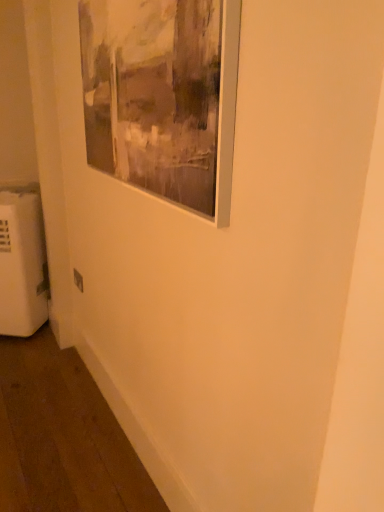
What do you see at coordinates (163, 96) in the screenshot? I see `matte silver picture frame at upper left` at bounding box center [163, 96].

The height and width of the screenshot is (512, 384). What do you see at coordinates (22, 262) in the screenshot?
I see `white plastic radiator at lower left` at bounding box center [22, 262].

The image size is (384, 512). What are the coordinates of `white plastic electric outlet at lower left` in the screenshot? It's located at (78, 280).

Between matte silver picture frame at upper left and white plastic radiator at lower left, which one has smaller size?

matte silver picture frame at upper left is smaller.

From a real-world perspective, which object rests below the other?

white plastic radiator at lower left is physically lower.

Is matte silver picture frame at upper left shorter than white plastic radiator at lower left?

Indeed, matte silver picture frame at upper left has a lesser height compared to white plastic radiator at lower left.

Is matte silver picture frame at upper left looking in the opposite direction of white plastic radiator at lower left?

No, white plastic radiator at lower left is not at the back of matte silver picture frame at upper left.

In the scene shown: Is white plastic radiator at lower left inside or outside of matte silver picture frame at upper left?

white plastic radiator at lower left is not enclosed by matte silver picture frame at upper left.

Relative to matte silver picture frame at upper left, is white plastic radiator at lower left in front or behind?

In the image, white plastic radiator at lower left appears behind matte silver picture frame at upper left.

From a real-world perspective, does white plastic radiator at lower left stand above matte silver picture frame at upper left?

Actually, white plastic radiator at lower left is physically below matte silver picture frame at upper left in the real world.

Considering the sizes of objects white plastic radiator at lower left and matte silver picture frame at upper left in the image provided, who is taller, white plastic radiator at lower left or matte silver picture frame at upper left?

white plastic radiator at lower left.

From a real-world perspective, is white plastic radiator at lower left beneath white plastic electric outlet at lower left?

Correct, in the physical world, white plastic radiator at lower left is lower than white plastic electric outlet at lower left.

Consider the image. Considering the relative sizes of white plastic radiator at lower left and white plastic electric outlet at lower left in the image provided, is white plastic radiator at lower left thinner than white plastic electric outlet at lower left?

Incorrect, the width of white plastic radiator at lower left is not less than that of white plastic electric outlet at lower left.

Is white plastic radiator at lower left beside white plastic electric outlet at lower left?

white plastic radiator at lower left is not next to white plastic electric outlet at lower left, and they're not touching.

Can you tell me how much white plastic radiator at lower left and white plastic electric outlet at lower left differ in facing direction?

They differ by 1.26 degrees in their facing directions.

Looking at this image, which is correct: matte silver picture frame at upper left is inside white plastic electric outlet at lower left, or outside of it?

matte silver picture frame at upper left cannot be found inside white plastic electric outlet at lower left.

Is matte silver picture frame at upper left facing towards white plastic electric outlet at lower left?

No, matte silver picture frame at upper left does not turn towards white plastic electric outlet at lower left.

Considering the relative sizes of matte silver picture frame at upper left and white plastic electric outlet at lower left in the image provided, is matte silver picture frame at upper left wider than white plastic electric outlet at lower left?

Indeed, matte silver picture frame at upper left has a greater width compared to white plastic electric outlet at lower left.

How different are the orientations of matte silver picture frame at upper left and white plastic electric outlet at lower left in degrees?

matte silver picture frame at upper left and white plastic electric outlet at lower left are facing 0.0845 degrees away from each other.

Is white plastic electric outlet at lower left looking in the opposite direction of matte silver picture frame at upper left?

white plastic electric outlet at lower left does not have its back to matte silver picture frame at upper left.

Considering the sizes of white plastic electric outlet at lower left and matte silver picture frame at upper left in the image, is white plastic electric outlet at lower left taller or shorter than matte silver picture frame at upper left?

white plastic electric outlet at lower left is shorter than matte silver picture frame at upper left.

Is white plastic electric outlet at lower left positioned in front of matte silver picture frame at upper left?

No.

Is white plastic electric outlet at lower left bigger than matte silver picture frame at upper left?

No.

Which is behind, white plastic electric outlet at lower left or white plastic radiator at lower left?

white plastic electric outlet at lower left.

Considering the relative positions of white plastic electric outlet at lower left and white plastic radiator at lower left in the image provided, is white plastic electric outlet at lower left to the right of white plastic radiator at lower left from the viewer's perspective?

Indeed, white plastic electric outlet at lower left is positioned on the right side of white plastic radiator at lower left.

Considering the positions of point (82, 283) and point (7, 330), is point (82, 283) closer or farther from the camera than point (7, 330)?

Clearly, point (82, 283) is closer to the camera than point (7, 330).

From the image's perspective, between white plastic electric outlet at lower left and white plastic radiator at lower left, who is located below?

white plastic electric outlet at lower left appears lower in the image.

Find the location of a particular element. The width and height of the screenshot is (384, 512). picture frame on the right of white plastic radiator at lower left is located at coordinates (163, 96).

Find the location of a particular element. This screenshot has height=512, width=384. radiator behind the matte silver picture frame at upper left is located at coordinates (22, 262).

From the image, which object appears to be nearer to white plastic radiator at lower left, matte silver picture frame at upper left or white plastic electric outlet at lower left?

Among the two, white plastic electric outlet at lower left is located nearer to white plastic radiator at lower left.

Based on their spatial positions, is white plastic electric outlet at lower left or matte silver picture frame at upper left closer to white plastic radiator at lower left?

white plastic electric outlet at lower left lies closer to white plastic radiator at lower left than the other object.

From the picture: Estimate the real-world distances between objects in this image. Which object is further from matte silver picture frame at upper left, white plastic radiator at lower left or white plastic electric outlet at lower left?

Among the two, white plastic radiator at lower left is located further to matte silver picture frame at upper left.

Estimate the real-world distances between objects in this image. Which object is further from matte silver picture frame at upper left, white plastic electric outlet at lower left or white plastic radiator at lower left?

Based on the image, white plastic radiator at lower left appears to be further to matte silver picture frame at upper left.

Which object lies nearer to the anchor point white plastic electric outlet at lower left, white plastic radiator at lower left or matte silver picture frame at upper left?

Based on the image, white plastic radiator at lower left appears to be nearer to white plastic electric outlet at lower left.

Considering their positions, is matte silver picture frame at upper left positioned further to white plastic electric outlet at lower left than white plastic radiator at lower left?

The object further to white plastic electric outlet at lower left is matte silver picture frame at upper left.

Where is `radiator positioned between matte silver picture frame at upper left and white plastic electric outlet at lower left from near to far`? This screenshot has width=384, height=512. radiator positioned between matte silver picture frame at upper left and white plastic electric outlet at lower left from near to far is located at coordinates (22, 262).